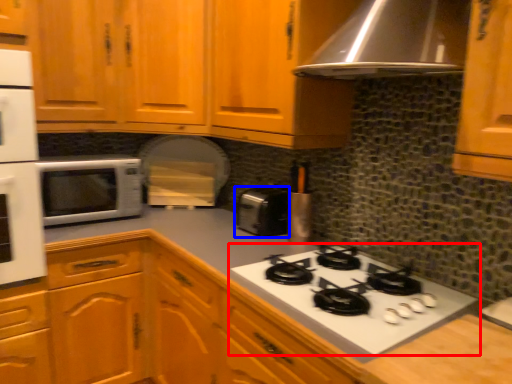
Question: Which point is closer to the camera, gas stove (highlighted by a red box) or toaster (highlighted by a blue box)?

Choices:
 (A) gas stove
 (B) toaster

Answer: (A)